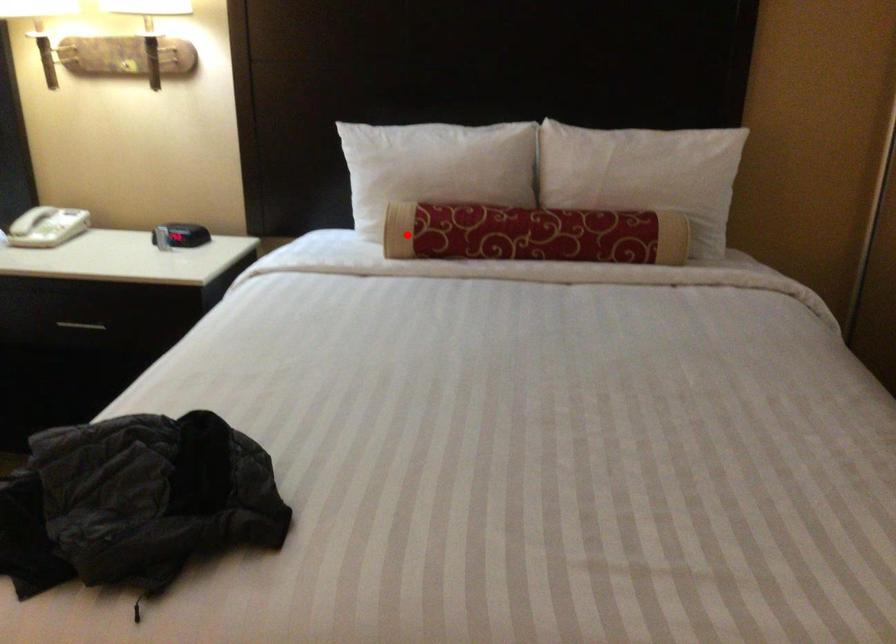
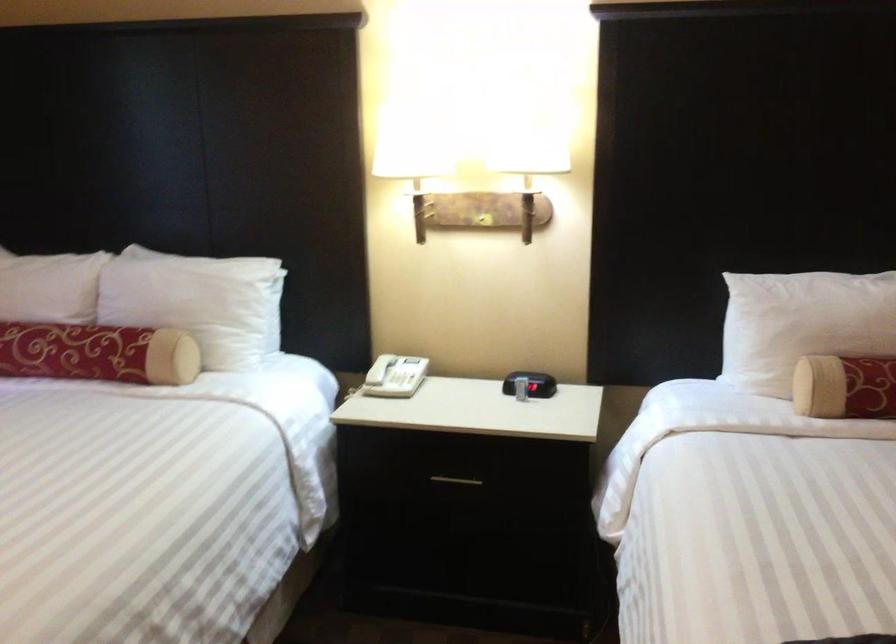
The point at the highlighted location is marked in the first image. Where is the corresponding point in the second image?

(845, 386)